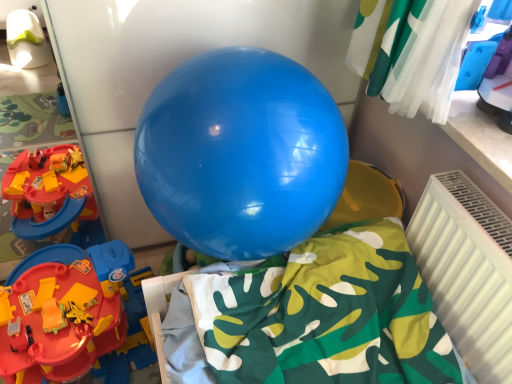
Question: Does rubberized plastic track at left have a larger size compared to white plastic radiator at lower right?

Choices:
 (A) yes
 (B) no

Answer: (A)

Question: Is the surface of rubberized plastic track at left in direct contact with white plastic radiator at lower right?

Choices:
 (A) yes
 (B) no

Answer: (B)

Question: Can you confirm if rubberized plastic track at left is taller than white plastic radiator at lower right?

Choices:
 (A) no
 (B) yes

Answer: (A)

Question: Would you say rubberized plastic track at left contains white plastic radiator at lower right?

Choices:
 (A) yes
 (B) no

Answer: (B)

Question: Is rubberized plastic track at left behind white plastic radiator at lower right?

Choices:
 (A) yes
 (B) no

Answer: (A)

Question: Considering the positions of rubberized plastic track at left and glossy blue balloon at center in the image, is rubberized plastic track at left wider or thinner than glossy blue balloon at center?

Choices:
 (A) wide
 (B) thin

Answer: (A)

Question: Based on their sizes in the image, would you say rubberized plastic track at left is bigger or smaller than glossy blue balloon at center?

Choices:
 (A) big
 (B) small

Answer: (B)

Question: From a real-world perspective, is rubberized plastic track at left physically located above or below glossy blue balloon at center?

Choices:
 (A) below
 (B) above

Answer: (A)

Question: Considering the positions of point (125, 344) and point (285, 92), is point (125, 344) closer or farther from the camera than point (285, 92)?

Choices:
 (A) farther
 (B) closer

Answer: (A)

Question: Is glossy blue balloon at center spatially inside rubberized plastic track at left, or outside of it?

Choices:
 (A) outside
 (B) inside

Answer: (A)

Question: Considering the positions of glossy blue balloon at center and rubberized plastic track at left in the image, is glossy blue balloon at center taller or shorter than rubberized plastic track at left?

Choices:
 (A) short
 (B) tall

Answer: (B)

Question: Considering the positions of glossy blue balloon at center and rubberized plastic track at left in the image, is glossy blue balloon at center bigger or smaller than rubberized plastic track at left?

Choices:
 (A) small
 (B) big

Answer: (B)

Question: Considering the positions of point (313, 162) and point (80, 314), is point (313, 162) closer or farther from the camera than point (80, 314)?

Choices:
 (A) closer
 (B) farther

Answer: (A)

Question: Is point (500, 307) positioned closer to the camera than point (247, 185)?

Choices:
 (A) closer
 (B) farther

Answer: (B)

Question: In terms of width, does white plastic radiator at lower right look wider or thinner when compared to glossy blue balloon at center?

Choices:
 (A) thin
 (B) wide

Answer: (A)